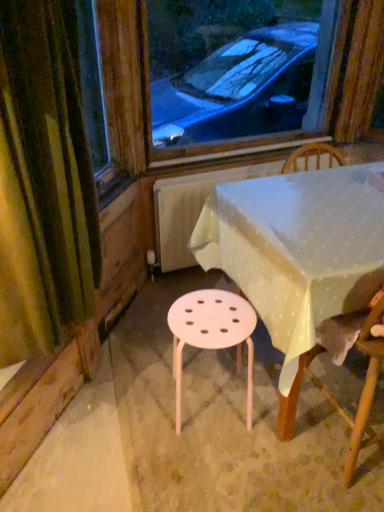
Locate an element on the screen. This screenshot has width=384, height=512. free space to the left of wooden chair at lower right is located at coordinates (261, 435).